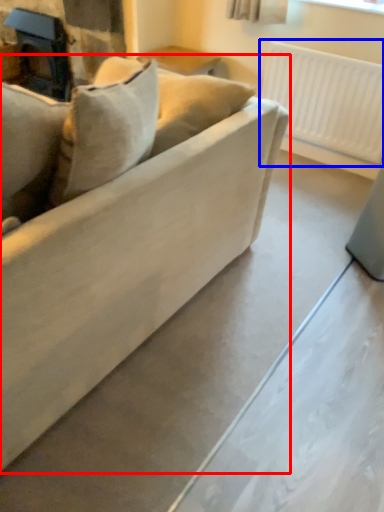
Question: Which of the following is the farthest to the observer, studio couch (highlighted by a red box) or radiator (highlighted by a blue box)?

Choices:
 (A) studio couch
 (B) radiator

Answer: (B)